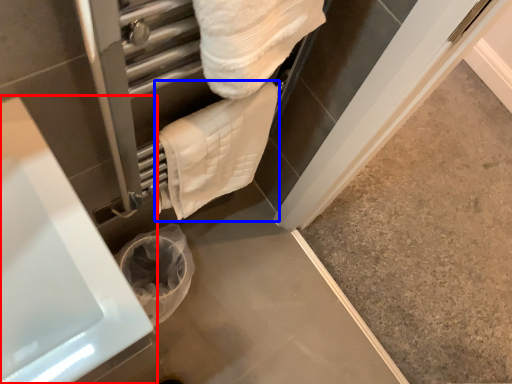
Question: Which object is further to the camera taking this photo, bath (highlighted by a red box) or towel (highlighted by a blue box)?

Choices:
 (A) bath
 (B) towel

Answer: (B)